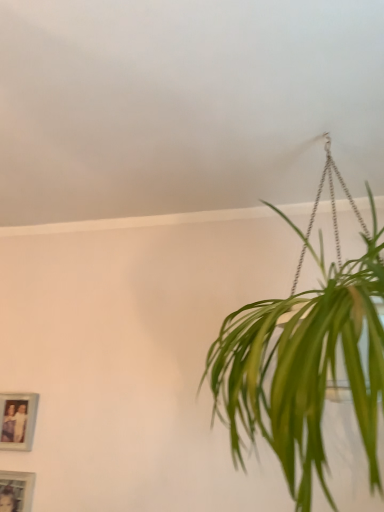
Question: Does matte blue picture frame at lower left, which ranks as the 1th picture frame in top-to-bottom order, lie behind wooden photo frame at lower left, which is the second picture frame in top-to-bottom order?

Choices:
 (A) no
 (B) yes

Answer: (B)

Question: From the image's perspective, does matte blue picture frame at lower left, which is the 2th picture frame from bottom to top, appear higher than wooden photo frame at lower left, the 1th picture frame ordered from the bottom?

Choices:
 (A) yes
 (B) no

Answer: (A)

Question: Does matte blue picture frame at lower left, which is the 2th picture frame from bottom to top, appear on the left side of wooden photo frame at lower left, the 1th picture frame ordered from the bottom?

Choices:
 (A) yes
 (B) no

Answer: (A)

Question: Is matte blue picture frame at lower left, which ranks as the 1th picture frame in top-to-bottom order, at the right side of wooden photo frame at lower left, the 1th picture frame ordered from the bottom?

Choices:
 (A) no
 (B) yes

Answer: (A)

Question: Is wooden photo frame at lower left, which is the second picture frame in top-to-bottom order, completely or partially inside matte blue picture frame at lower left, which is the 2th picture frame from bottom to top?

Choices:
 (A) no
 (B) yes

Answer: (A)

Question: Considering the relative sizes of matte blue picture frame at lower left, which is the 2th picture frame from bottom to top, and wooden photo frame at lower left, the 1th picture frame ordered from the bottom, in the image provided, is matte blue picture frame at lower left, which is the 2th picture frame from bottom to top, taller than wooden photo frame at lower left, the 1th picture frame ordered from the bottom,?

Choices:
 (A) yes
 (B) no

Answer: (B)

Question: Does wooden photo frame at lower left, which is the second picture frame in top-to-bottom order, have a greater height compared to matte blue picture frame at lower left, which ranks as the 1th picture frame in top-to-bottom order?

Choices:
 (A) no
 (B) yes

Answer: (B)

Question: Is the position of wooden photo frame at lower left, which is the second picture frame in top-to-bottom order, more distant than that of matte blue picture frame at lower left, which ranks as the 1th picture frame in top-to-bottom order?

Choices:
 (A) no
 (B) yes

Answer: (A)

Question: Is wooden photo frame at lower left, which is the second picture frame in top-to-bottom order, closer to the viewer compared to matte blue picture frame at lower left, which ranks as the 1th picture frame in top-to-bottom order?

Choices:
 (A) yes
 (B) no

Answer: (A)

Question: Does wooden photo frame at lower left, the 1th picture frame ordered from the bottom, appear on the left side of matte blue picture frame at lower left, which is the 2th picture frame from bottom to top?

Choices:
 (A) yes
 (B) no

Answer: (B)

Question: Considering the relative sizes of wooden photo frame at lower left, the 1th picture frame ordered from the bottom, and matte blue picture frame at lower left, which is the 2th picture frame from bottom to top, in the image provided, is wooden photo frame at lower left, the 1th picture frame ordered from the bottom, thinner than matte blue picture frame at lower left, which is the 2th picture frame from bottom to top,?

Choices:
 (A) no
 (B) yes

Answer: (B)

Question: Would you say wooden photo frame at lower left, the 1th picture frame ordered from the bottom, is a long distance from matte blue picture frame at lower left, which ranks as the 1th picture frame in top-to-bottom order?

Choices:
 (A) no
 (B) yes

Answer: (A)

Question: Considering the positions of point (9, 508) and point (21, 430), is point (9, 508) closer or farther from the camera than point (21, 430)?

Choices:
 (A) closer
 (B) farther

Answer: (A)